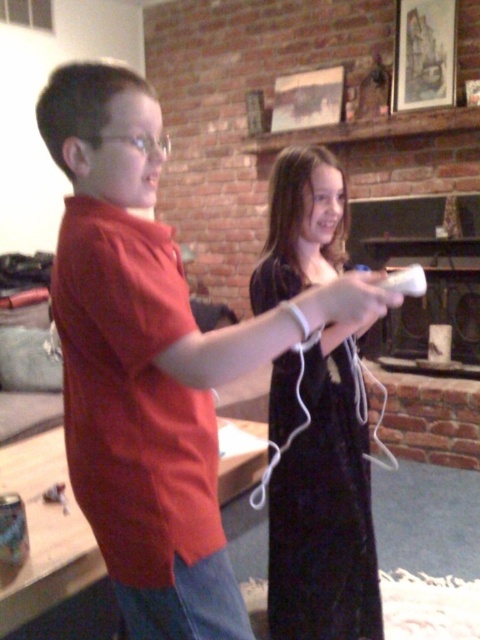
You are a fashion designer who needs to place a red scarf on the black velvet dress at center. According to the image, where should you place the scarf relative to the dress?

The black velvet dress at center is located at point [324,509], so the red scarf should be placed at the center of the dress.